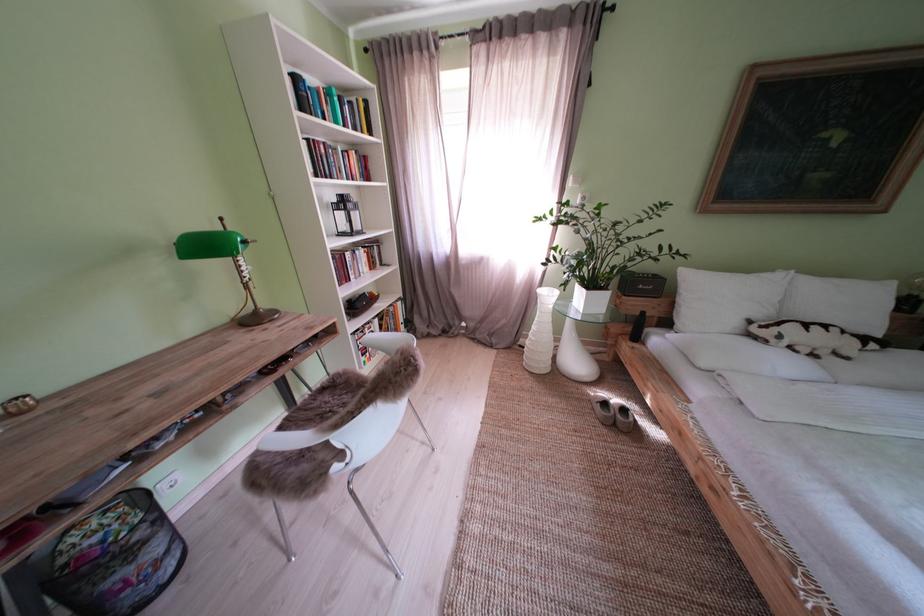
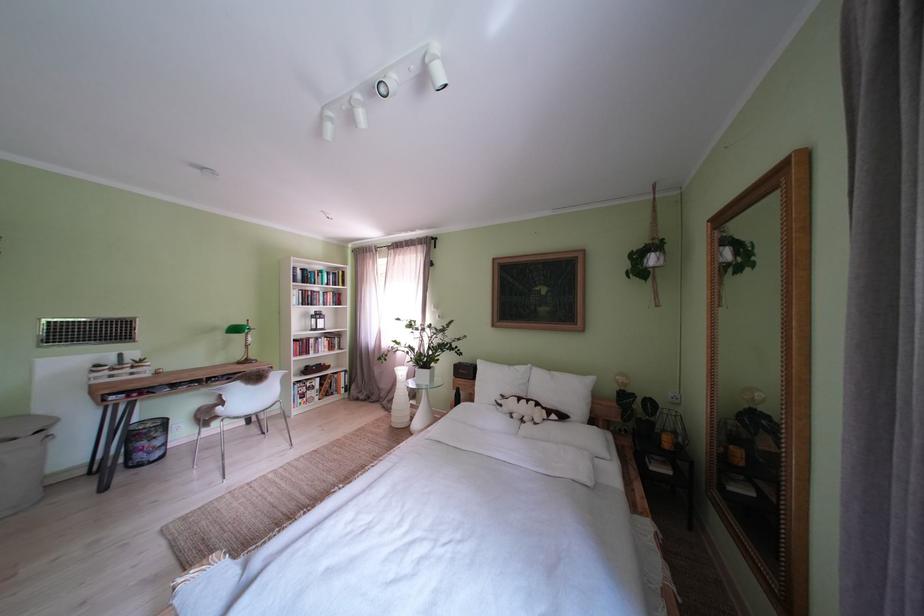
In the second image, find the point that corresponds to [217,252] in the first image.

(247, 334)